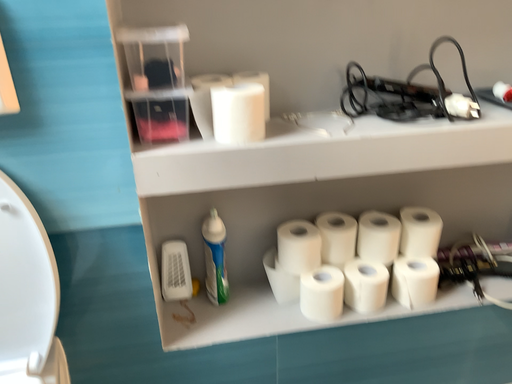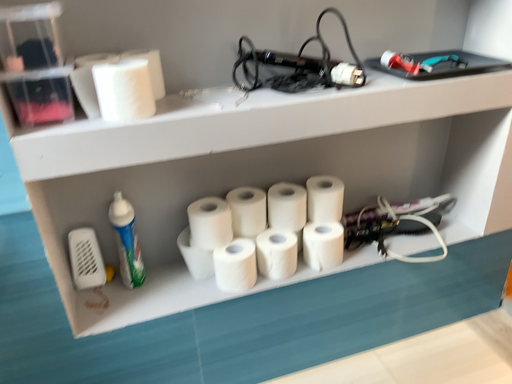
Question: How did the camera likely rotate when shooting the video?

Choices:
 (A) rotated right
 (B) rotated left

Answer: (A)